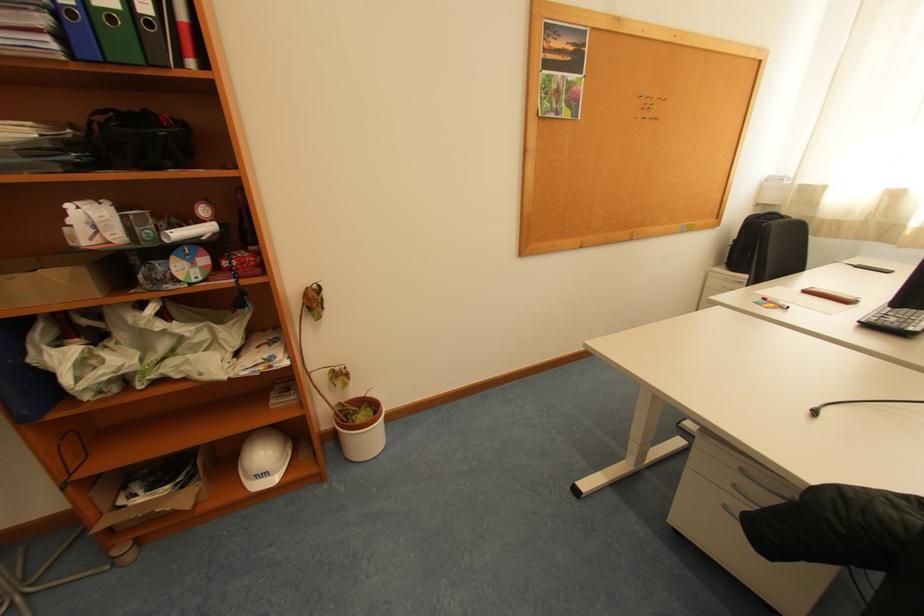
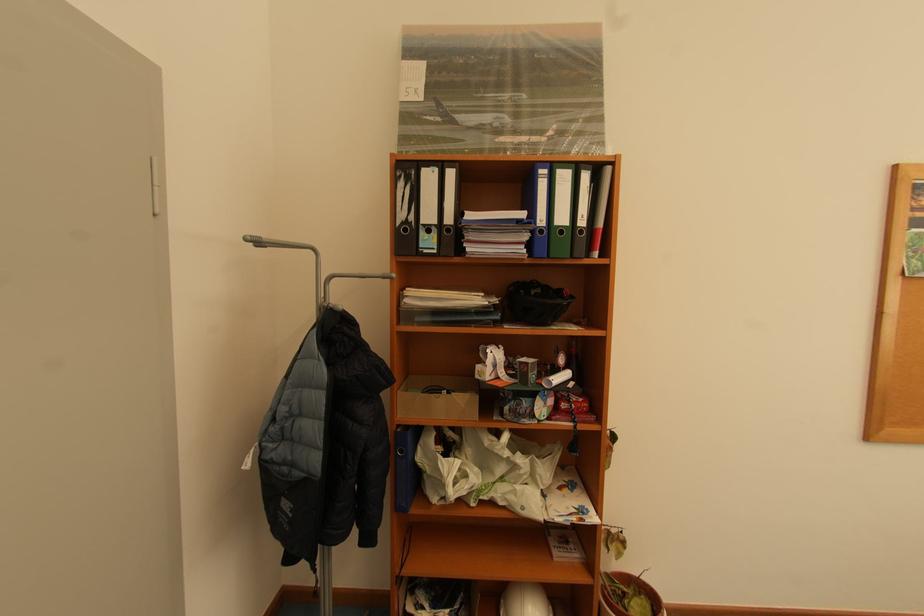
In the second image, find the point that corresponds to point (137, 217) in the first image.

(536, 365)